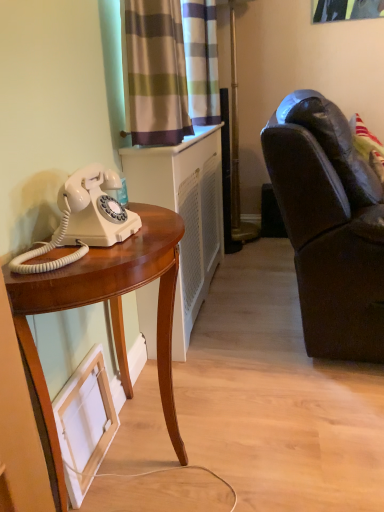
At what (x,y) coordinates should I click in order to perform the action: click on free point behind white matte picture frame at lower left. Please return your answer as a coordinate pair (x, y). This screenshot has height=512, width=384. Looking at the image, I should click on (132, 418).